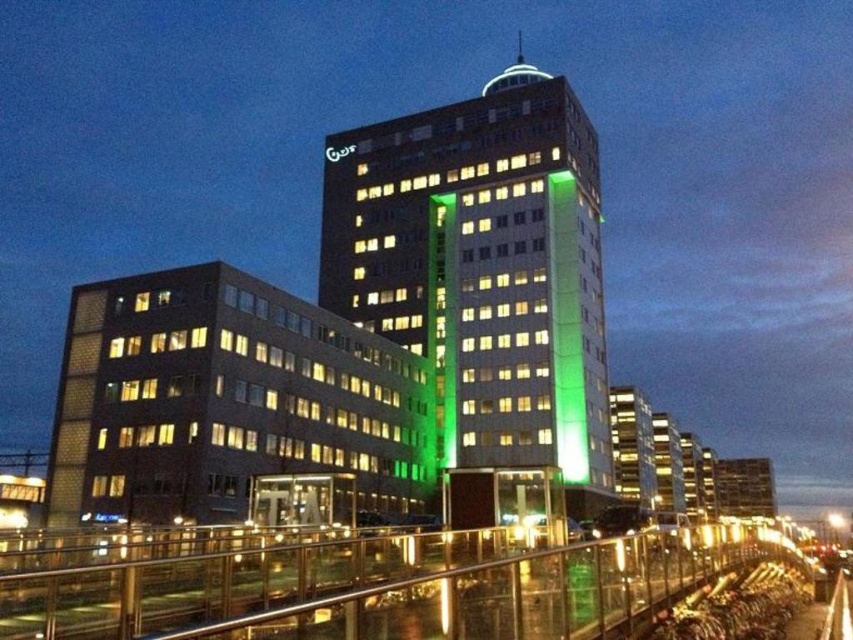
Question: Which point is farther from the camera taking this photo?

Choices:
 (A) (74, 289)
 (B) (370, 280)
 (C) (341, 150)
 (D) (482, 586)

Answer: (C)

Question: Which point appears farthest from the camera in this image?

Choices:
 (A) (74, 460)
 (B) (346, 147)
 (C) (254, 582)

Answer: (B)

Question: Which point is closer to the camera taking this photo?

Choices:
 (A) (585, 577)
 (B) (584, 145)

Answer: (A)

Question: Does green glass building at center appear under clear glass railing at lower center?

Choices:
 (A) no
 (B) yes

Answer: (A)

Question: Can you confirm if green glass building at center is smaller than brown brick building at lower left?

Choices:
 (A) no
 (B) yes

Answer: (A)

Question: Is brown brick building at lower left bigger than green glass sign at upper center?

Choices:
 (A) no
 (B) yes

Answer: (B)